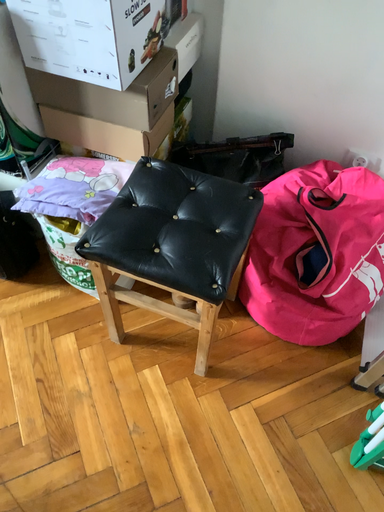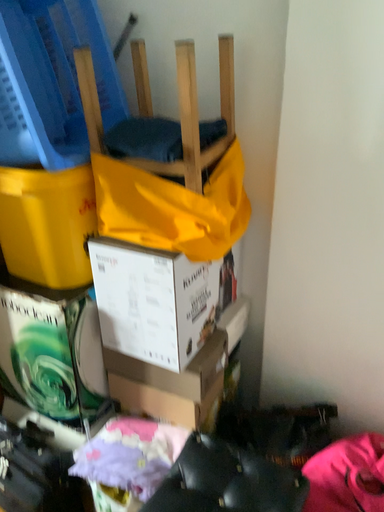
Question: How did the camera likely rotate when shooting the video?

Choices:
 (A) rotated upward
 (B) rotated downward

Answer: (A)